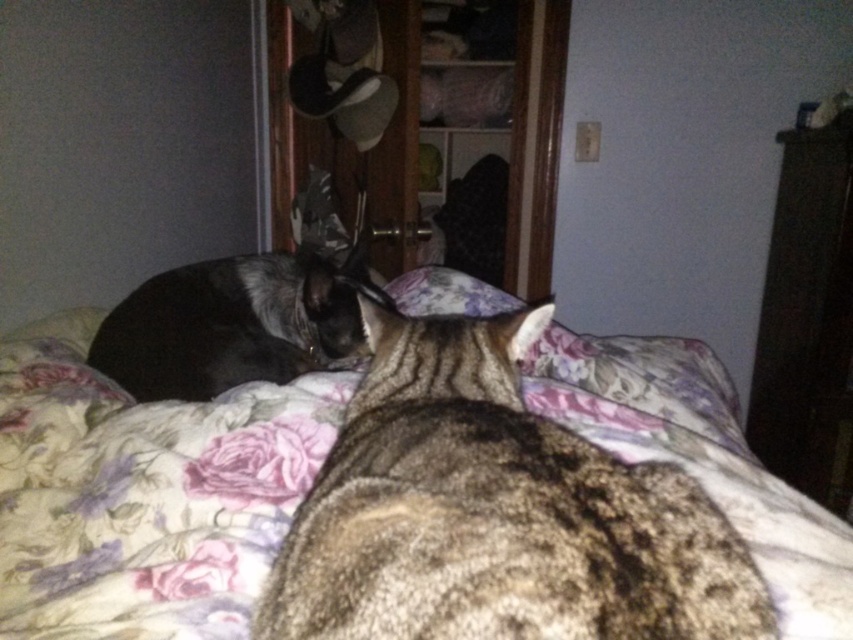
Between floral fabric bed at center and dark wood dresser at right, which one is positioned higher?

dark wood dresser at right is above.

Is floral fabric bed at center above dark wood dresser at right?

No.

Which is in front, point (583, 355) or point (805, 212)?

Positioned in front is point (583, 355).

The width and height of the screenshot is (853, 640). I want to click on floral fabric bed at center, so 143,493.

Who is more forward, (x=799, y=192) or (x=204, y=342)?

Point (x=204, y=342) is more forward.

Is dark wood dresser at right taller than tabby fur at left?

Indeed, dark wood dresser at right has a greater height compared to tabby fur at left.

Where is `dark wood dresser at right`? This screenshot has width=853, height=640. dark wood dresser at right is located at coordinates (807, 317).

Is floral fabric bed at center above tabby fur at left?

No.

Which is more to the right, floral fabric bed at center or tabby fur at left?

From the viewer's perspective, floral fabric bed at center appears more on the right side.

The width and height of the screenshot is (853, 640). I want to click on floral fabric bed at center, so [x=143, y=493].